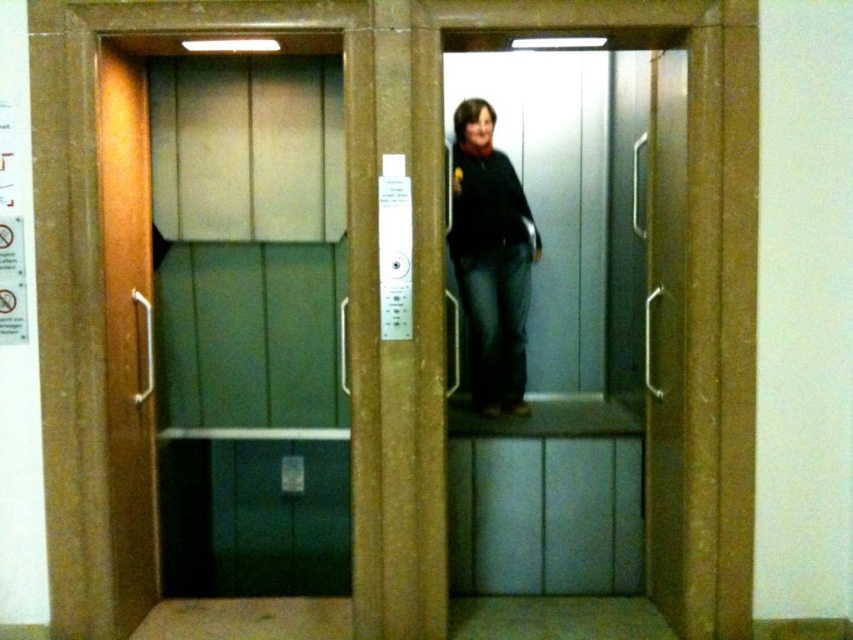
Question: Can you confirm if wooden door at left is smaller than wooden elevator door at center?

Choices:
 (A) no
 (B) yes

Answer: (A)

Question: Estimate the real-world distances between objects in this image. Which object is closer to the wooden elevator door at center?

Choices:
 (A) wooden door at left
 (B) matte black sweater at center

Answer: (B)

Question: Among these points, which one is farthest from the camera?

Choices:
 (A) coord(532,260)
 (B) coord(146,547)
 (C) coord(679,268)

Answer: (A)

Question: Which of these objects is positioned closest to the wooden elevator door at center?

Choices:
 (A) matte black sweater at center
 (B) wooden door at left

Answer: (A)

Question: Does wooden door at left appear under wooden elevator door at center?

Choices:
 (A) no
 (B) yes

Answer: (B)

Question: Is wooden door at left positioned at the back of wooden elevator door at center?

Choices:
 (A) yes
 (B) no

Answer: (B)